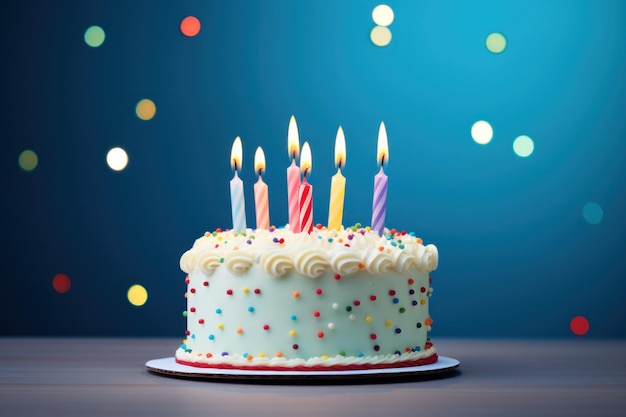
Locate an element on the screen. Image resolution: width=626 pixels, height=417 pixels. sprinkle decorations is located at coordinates (315, 287), (332, 272), (310, 313), (317, 338), (346, 299), (372, 293), (394, 291).